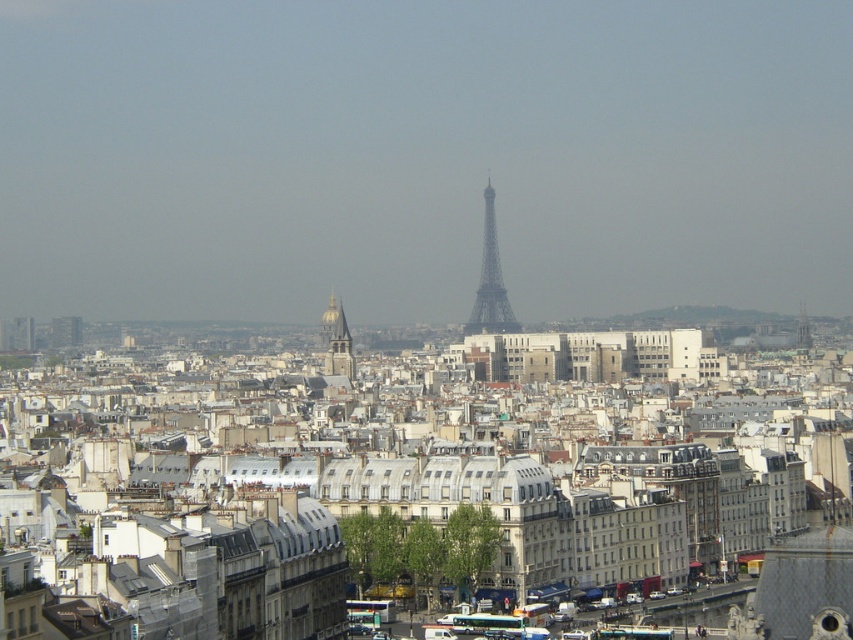
Question: Among these objects, which one is nearest to the camera?

Choices:
 (A) goldmaterial/texturetower at center
 (B) metallic structure at center

Answer: (A)

Question: Does metallic structure at center appear on the right side of goldmaterial/texturetower at center?

Choices:
 (A) no
 (B) yes

Answer: (B)

Question: Which of the following is the closest to the observer?

Choices:
 (A) goldmaterial/texturetower at center
 (B) metallic structure at center

Answer: (A)

Question: Is metallic structure at center above goldmaterial/texturetower at center?

Choices:
 (A) no
 (B) yes

Answer: (B)

Question: Which object is farther from the camera taking this photo?

Choices:
 (A) goldmaterial/texturetower at center
 (B) metallic structure at center

Answer: (B)

Question: Is metallic structure at center below goldmaterial/texturetower at center?

Choices:
 (A) no
 (B) yes

Answer: (A)